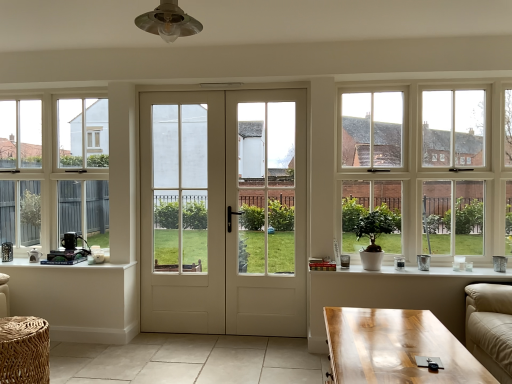
Question: Is woven rattan table at lower left, which is the 1th table from front to back, next to clear glass window at right, which is the second window in left-to-right order, and touching it?

Choices:
 (A) yes
 (B) no

Answer: (B)

Question: Does woven rattan table at lower left, which is the 1th table from front to back, have a larger size compared to clear glass window at right, placed as the first window when sorted from right to left?

Choices:
 (A) no
 (B) yes

Answer: (A)

Question: From a real-world perspective, is woven rattan table at lower left, which is the 1th table from front to back, positioned under clear glass window at right, which is the second window in left-to-right order, based on gravity?

Choices:
 (A) no
 (B) yes

Answer: (B)

Question: Would you say clear glass window at right, placed as the first window when sorted from right to left, is part of woven rattan table at lower left, which is the 1th table from front to back,'s contents?

Choices:
 (A) no
 (B) yes

Answer: (A)

Question: Does woven rattan table at lower left, which is the second table in back-to-front order, have a lesser width compared to clear glass window at right, which is the second window in left-to-right order?

Choices:
 (A) no
 (B) yes

Answer: (A)

Question: Would you say woven rattan table at lower left, which is the second table in back-to-front order, is a long distance from clear glass window at right, placed as the first window when sorted from right to left?

Choices:
 (A) yes
 (B) no

Answer: (A)

Question: From the image's perspective, would you say white smooth door at center is shown under white ceramic pot at lower right?

Choices:
 (A) yes
 (B) no

Answer: (B)

Question: Does white smooth door at center have a smaller size compared to white ceramic pot at lower right?

Choices:
 (A) yes
 (B) no

Answer: (B)

Question: Could you tell me if white smooth door at center is turned towards white ceramic pot at lower right?

Choices:
 (A) yes
 (B) no

Answer: (B)

Question: Can you confirm if white smooth door at center is wider than white ceramic pot at lower right?

Choices:
 (A) yes
 (B) no

Answer: (B)

Question: Can you confirm if white smooth door at center is bigger than white ceramic pot at lower right?

Choices:
 (A) no
 (B) yes

Answer: (B)

Question: Is white smooth door at center thinner than white ceramic pot at lower right?

Choices:
 (A) no
 (B) yes

Answer: (B)

Question: From the image's perspective, would you say clear glass window at left, arranged as the second window when viewed from the front, is shown under white glossy door at center, the second screen door from the left?

Choices:
 (A) yes
 (B) no

Answer: (B)